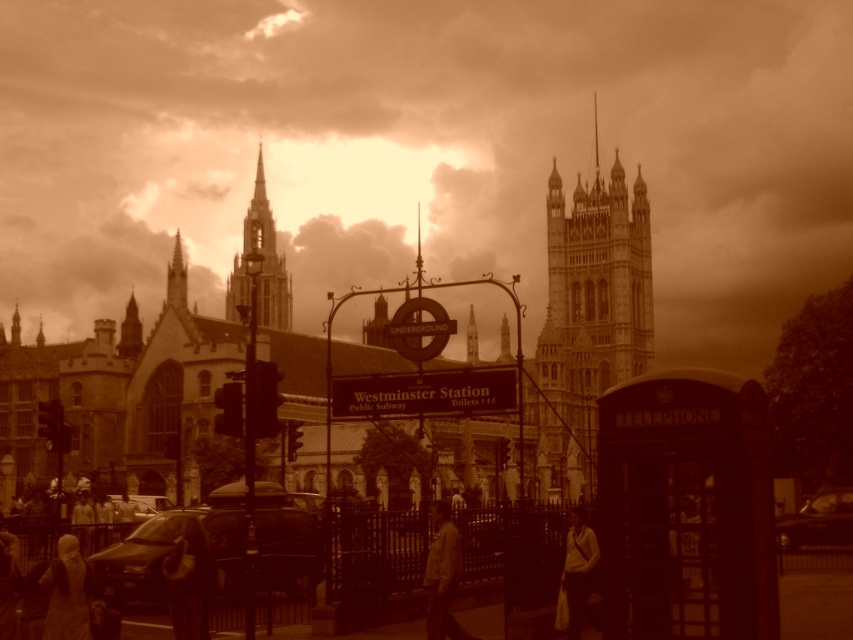
Does dark textured coat at lower left have a smaller size compared to matte beige coat at lower left?

No.

Measure the distance between dark textured coat at lower left and camera.

dark textured coat at lower left is 62.47 meters away from camera.

Find the location of a particular element. This screenshot has height=640, width=853. dark textured coat at lower left is located at coordinates (190, 580).

The height and width of the screenshot is (640, 853). What do you see at coordinates (590, 310) in the screenshot?
I see `stone gothic tower at center` at bounding box center [590, 310].

Who is taller, stone gothic tower at center or shiny black car at lower right?

stone gothic tower at center

Between point (543, 428) and point (811, 513), which one is positioned in front?

Point (811, 513) is more forward.

Identify the location of stone gothic tower at center. This screenshot has width=853, height=640. (590, 310).

Is sepia textured sky at upper center behind stone gothic tower at center?

No, sepia textured sky at upper center is in front of stone gothic tower at center.

What do you see at coordinates (424, 148) in the screenshot? The width and height of the screenshot is (853, 640). I see `sepia textured sky at upper center` at bounding box center [424, 148].

The width and height of the screenshot is (853, 640). I want to click on sepia textured sky at upper center, so click(424, 148).

Locate an element on the screen. sepia textured sky at upper center is located at coordinates (424, 148).